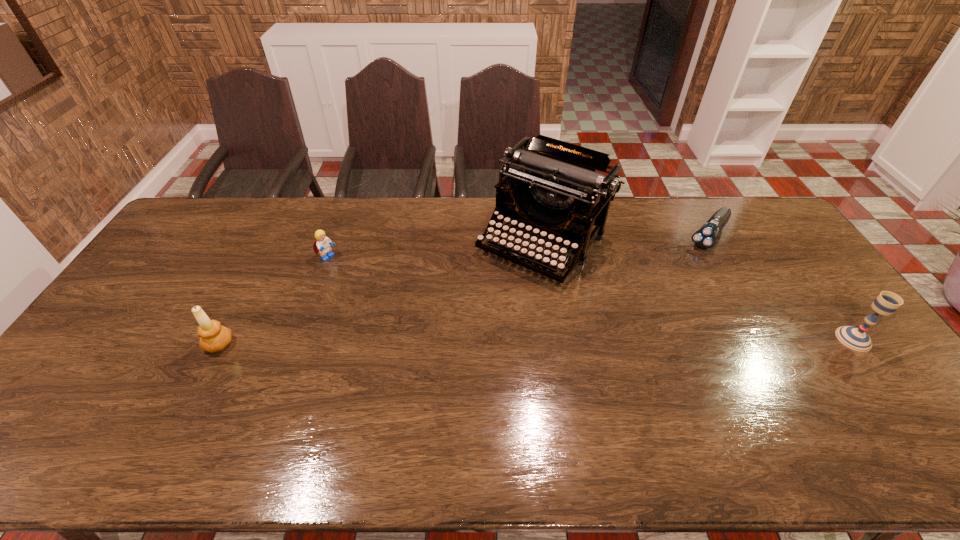
Where is `free spot that satisfies the following two spatial constraints: 1. on the back side of the Lego; 2. on the right side of the fourth object from left to right`? The image size is (960, 540). free spot that satisfies the following two spatial constraints: 1. on the back side of the Lego; 2. on the right side of the fourth object from left to right is located at coordinates point(335,236).

This screenshot has width=960, height=540. I want to click on vacant area that satisfies the following two spatial constraints: 1. on the back side of the Lego; 2. on the left side of the second object from right to left, so click(x=335, y=236).

At what (x,y) coordinates should I click in order to perform the action: click on free region that satisfies the following two spatial constraints: 1. on the back side of the chalice; 2. on the right side of the candle_holder. Please return your answer as a coordinate pair (x, y). Looking at the image, I should click on (222, 339).

Locate an element on the screen. The width and height of the screenshot is (960, 540). free space in the image that satisfies the following two spatial constraints: 1. on the back side of the fourth object from right to left; 2. on the left side of the shortest object is located at coordinates (335, 236).